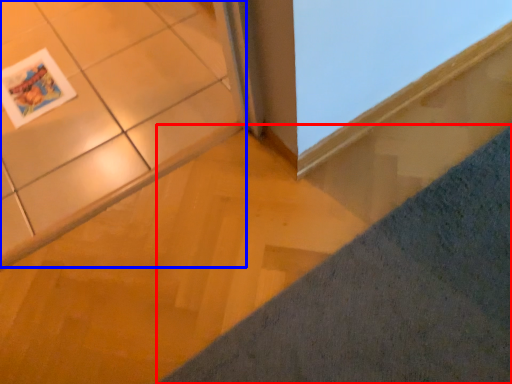
Question: Which object is further to the camera taking this photo, concrete (highlighted by a red box) or ceramic tile (highlighted by a blue box)?

Choices:
 (A) concrete
 (B) ceramic tile

Answer: (B)